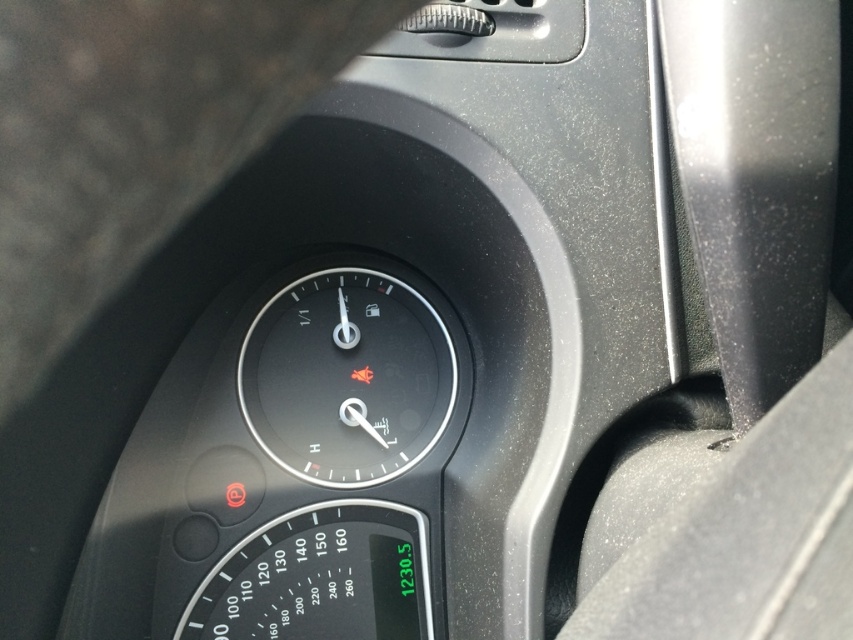
Question: Which object is closer to the camera taking this photo?

Choices:
 (A) black plastic speedometer at lower center
 (B) black matte speedometer at center

Answer: (A)

Question: Can you confirm if black matte speedometer at center is thinner than black plastic speedometer at lower center?

Choices:
 (A) yes
 (B) no

Answer: (A)

Question: Is black matte speedometer at center bigger than black plastic speedometer at lower center?

Choices:
 (A) yes
 (B) no

Answer: (B)

Question: Does black matte speedometer at center come in front of black plastic speedometer at lower center?

Choices:
 (A) yes
 (B) no

Answer: (B)

Question: Among these points, which one is nearest to the camera?

Choices:
 (A) (360, 394)
 (B) (395, 541)

Answer: (A)